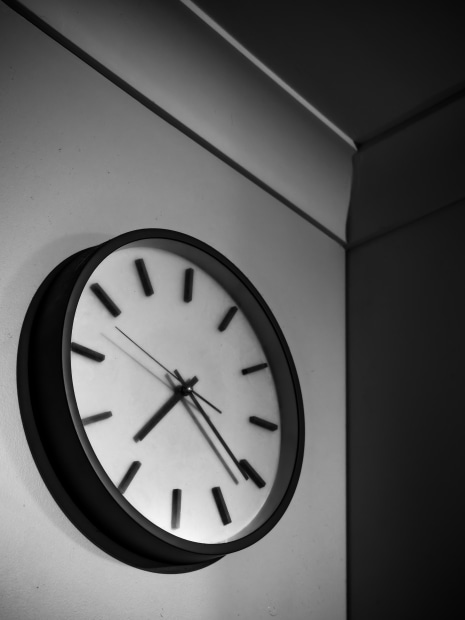
Where is `clock rim`? This screenshot has width=465, height=620. clock rim is located at coordinates (73, 401).